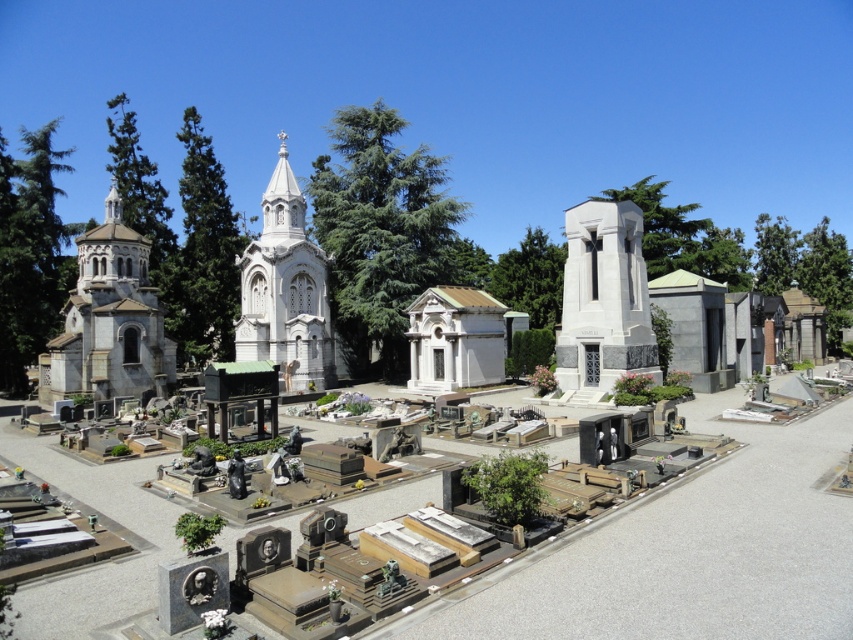
Is point (44, 403) closer to camera compared to point (312, 289)?

Yes, it is in front of point (312, 289).

Which is in front, point (112, 314) or point (245, 253)?

Point (112, 314) is more forward.

Does point (68, 353) come farther from viewer compared to point (305, 369)?

No, (68, 353) is closer to viewer.

Locate an element on the screen. white marble church at left is located at coordinates (109, 321).

Who is positioned more to the left, white marble monument at center or white marble church at center?

From the viewer's perspective, white marble church at center appears more on the left side.

Is point (604, 296) less distant than point (316, 316)?

Yes.

Identify the location of white marble monument at center. The width and height of the screenshot is (853, 640). (604, 300).

Where is `white marble monument at center`? The width and height of the screenshot is (853, 640). white marble monument at center is located at coordinates (604, 300).

Does white marble church at left have a lesser height compared to white marble monument at center?

Incorrect, white marble church at left's height does not fall short of white marble monument at center's.

Can you confirm if white marble church at left is wider than white marble monument at center?

Indeed, white marble church at left has a greater width compared to white marble monument at center.

Is point (73, 326) less distant than point (596, 273)?

No, it is not.

This screenshot has width=853, height=640. I want to click on white marble church at left, so click(109, 321).